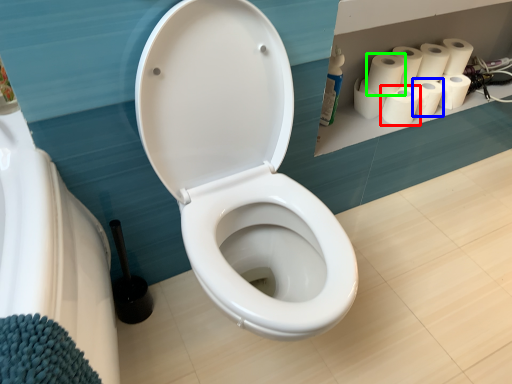
Question: Estimate the real-world distances between objects in this image. Which object is closer to paper towel (highlighted by a red box), paper towel (highlighted by a blue box) or paper towel (highlighted by a green box)?

Choices:
 (A) paper towel
 (B) paper towel

Answer: (A)